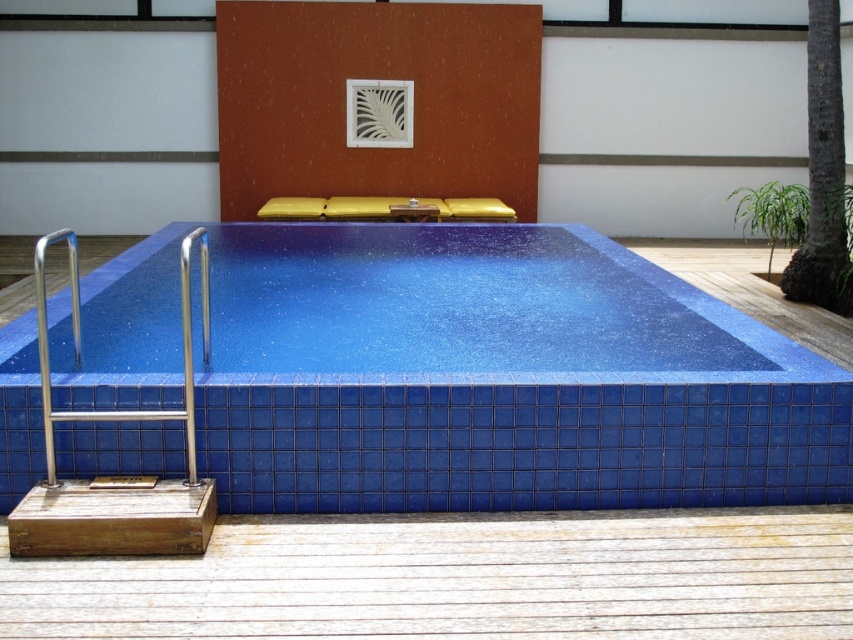
What do you see at coordinates (496, 378) in the screenshot?
I see `blue glossy tile swimming pool at lower left` at bounding box center [496, 378].

Is blue glossy tile swimming pool at lower left wider than satin stainless steel handrail at lower left?

Correct, the width of blue glossy tile swimming pool at lower left exceeds that of satin stainless steel handrail at lower left.

Where is `blue glossy tile swimming pool at lower left`? blue glossy tile swimming pool at lower left is located at coordinates (496, 378).

Is blue glossy tile swimming pool at lower left above polished stainless steel handrail at lower left?

Actually, blue glossy tile swimming pool at lower left is below polished stainless steel handrail at lower left.

Is blue glossy tile swimming pool at lower left thinner than polished stainless steel handrail at lower left?

In fact, blue glossy tile swimming pool at lower left might be wider than polished stainless steel handrail at lower left.

Find the location of a particular element. Image resolution: width=853 pixels, height=640 pixels. blue glossy tile swimming pool at lower left is located at coordinates (496, 378).

Locate an element on the screen. The image size is (853, 640). blue glossy tile swimming pool at lower left is located at coordinates (496, 378).

Can you confirm if blue glossy tile swimming pool at lower left is positioned to the left of green leafy palm tree at upper right?

Yes, blue glossy tile swimming pool at lower left is to the left of green leafy palm tree at upper right.

Based on the photo, who is positioned more to the left, blue glossy tile swimming pool at lower left or green leafy palm tree at upper right?

From the viewer's perspective, blue glossy tile swimming pool at lower left appears more on the left side.

Which is in front, point (51, 298) or point (804, 192)?

Point (51, 298)

The height and width of the screenshot is (640, 853). In order to click on blue glossy tile swimming pool at lower left in this screenshot , I will do `click(496, 378)`.